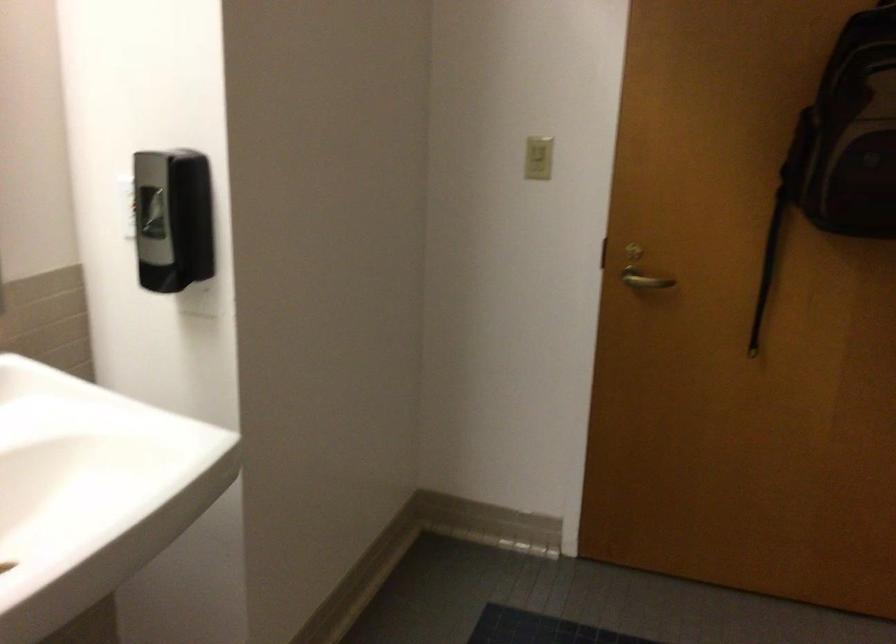
You are a GUI agent. You are given a task and a screenshot of the screen. Output one action in this format:
    pyautogui.click(x=<x>, y=<y>)
    Task: Click on the door handle
    The height and width of the screenshot is (644, 896).
    Given the screenshot: What is the action you would take?
    pyautogui.click(x=643, y=279)